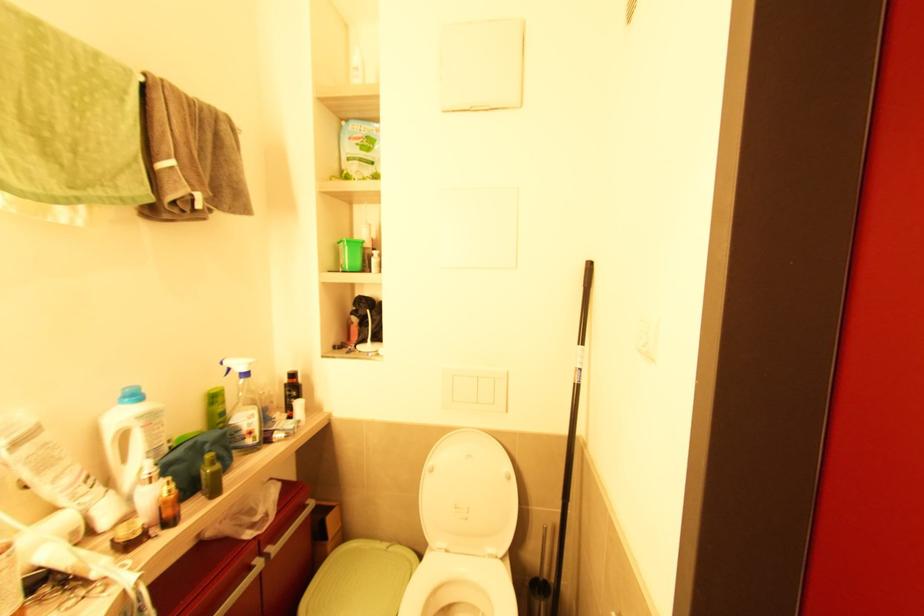
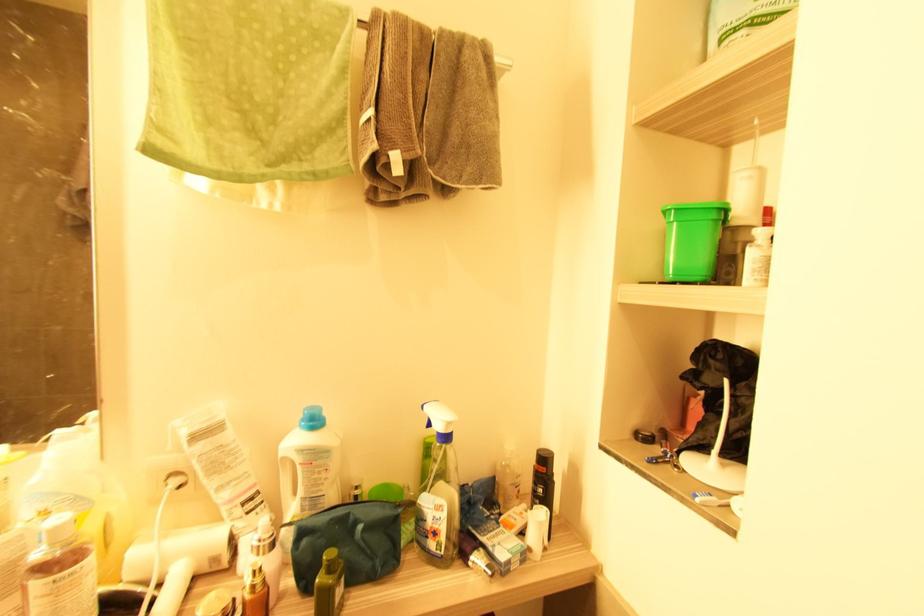
Question: The camera is either moving clockwise (left) or counter-clockwise (right) around the object. The first image is from the beginning of the video and the second image is from the end. Is the camera moving left or right when shooting the video?

Choices:
 (A) Left
 (B) Right

Answer: (B)